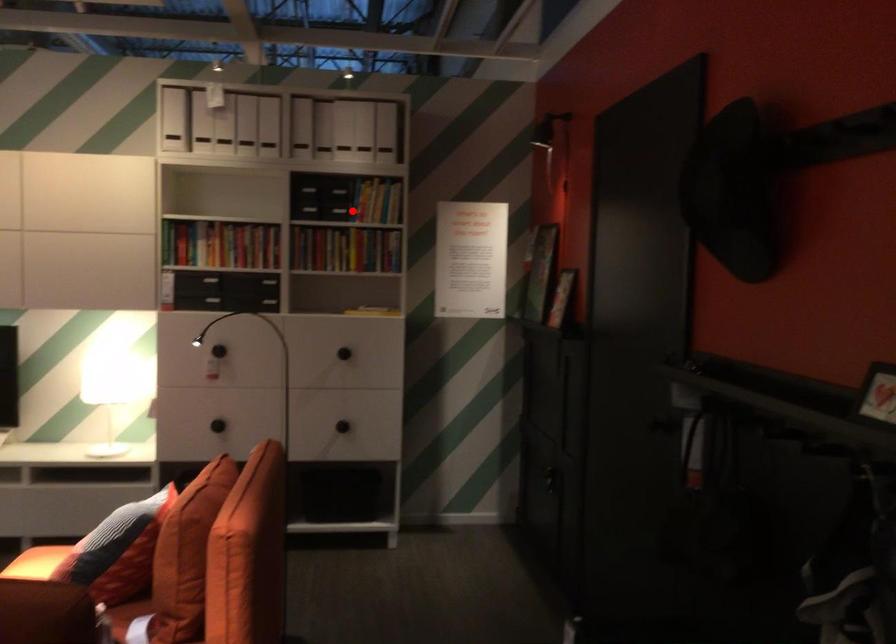
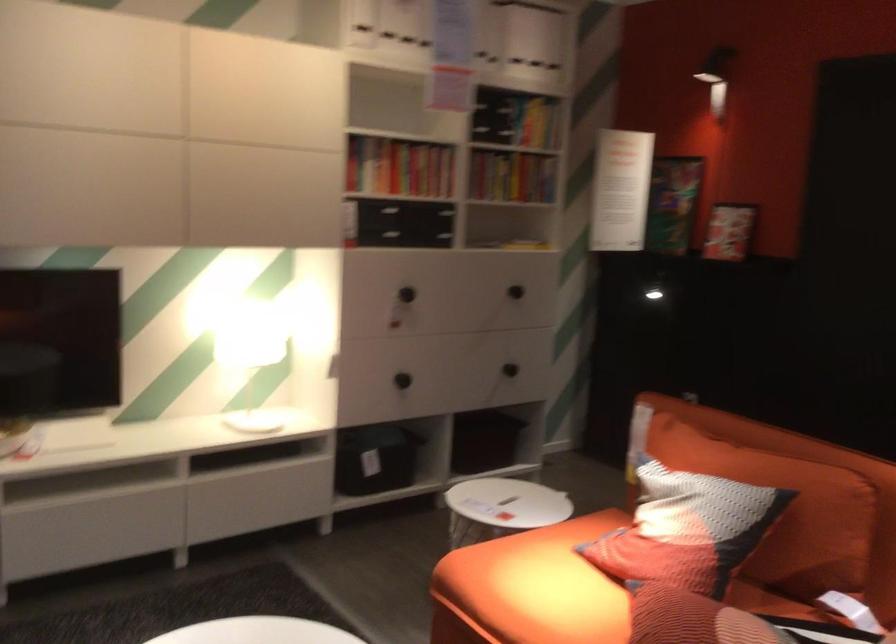
In the second image, find the point that corresponds to the highlighted location in the first image.

(538, 124)